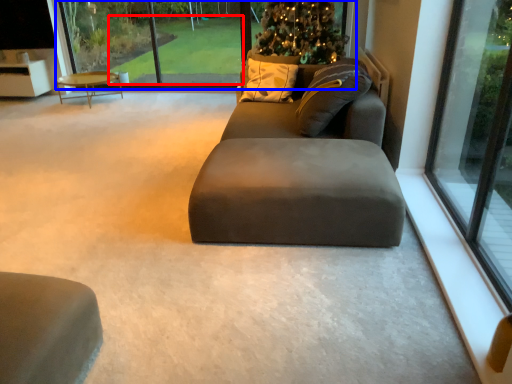
Question: Which point is further to the camera, golf course (highlighted by a red box) or glass window (highlighted by a blue box)?

Choices:
 (A) golf course
 (B) glass window

Answer: (A)